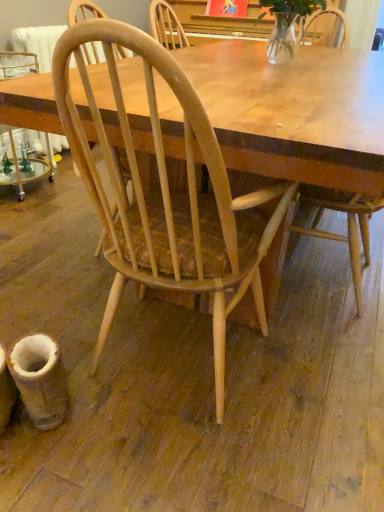
Question: Is natural wood chair at center, acting as the 1th chair starting from the left, bigger or smaller than light wood chair at center, marked as the 2th chair in a left-to-right arrangement?

Choices:
 (A) small
 (B) big

Answer: (B)

Question: Considering the relative positions of natural wood chair at center, which is the second chair from right to left, and light wood chair at center, marked as the 2th chair in a left-to-right arrangement, in the image provided, is natural wood chair at center, which is the second chair from right to left, to the left or to the right of light wood chair at center, marked as the 2th chair in a left-to-right arrangement,?

Choices:
 (A) right
 (B) left

Answer: (B)

Question: Which object is positioned closest to the clear glass vase at upper center?

Choices:
 (A) light wood chair at center, the first chair from the right
 (B) natural wood chair at center, which is the second chair from right to left

Answer: (A)

Question: Based on their relative distances, which object is nearer to the natural wood chair at center, which is the second chair from right to left?

Choices:
 (A) light wood chair at center, the first chair from the right
 (B) clear glass vase at upper center

Answer: (A)